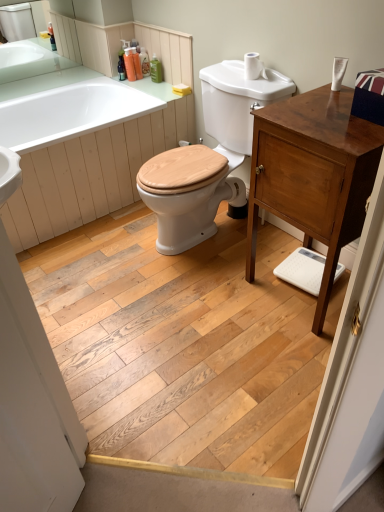
Question: Does white glossy bathtub at upper left come behind shiny brown cabinet at right?

Choices:
 (A) yes
 (B) no

Answer: (A)

Question: Is white glossy bathtub at upper left positioned with its back to shiny brown cabinet at right?

Choices:
 (A) no
 (B) yes

Answer: (A)

Question: From the image's perspective, is white glossy bathtub at upper left below shiny brown cabinet at right?

Choices:
 (A) no
 (B) yes

Answer: (A)

Question: Can you confirm if white glossy bathtub at upper left is shorter than shiny brown cabinet at right?

Choices:
 (A) yes
 (B) no

Answer: (A)

Question: Can you confirm if white glossy bathtub at upper left is positioned to the right of shiny brown cabinet at right?

Choices:
 (A) yes
 (B) no

Answer: (B)

Question: Is translucent plastic soap dispenser at upper center, which is counted as the 3th toiletry, starting from the right, wider or thinner than green matte countertop at upper left?

Choices:
 (A) thin
 (B) wide

Answer: (A)

Question: In terms of height, does translucent plastic soap dispenser at upper center, the second toiletry positioned from the left, look taller or shorter compared to green matte countertop at upper left?

Choices:
 (A) short
 (B) tall

Answer: (B)

Question: From a real-world perspective, relative to green matte countertop at upper left, is translucent plastic soap dispenser at upper center, the second toiletry positioned from the left, vertically above or below?

Choices:
 (A) above
 (B) below

Answer: (A)

Question: Is translucent plastic soap dispenser at upper center, which is counted as the 3th toiletry, starting from the right, inside or outside of green matte countertop at upper left?

Choices:
 (A) outside
 (B) inside

Answer: (A)

Question: Choose the correct answer: Is natural wood floor at center inside shiny brown cabinet at right or outside it?

Choices:
 (A) outside
 (B) inside

Answer: (A)

Question: Is natural wood floor at center in front of or behind shiny brown cabinet at right in the image?

Choices:
 (A) behind
 (B) front

Answer: (B)

Question: Considering the positions of natural wood floor at center and shiny brown cabinet at right in the image, is natural wood floor at center taller or shorter than shiny brown cabinet at right?

Choices:
 (A) short
 (B) tall

Answer: (A)

Question: In terms of size, does natural wood floor at center appear bigger or smaller than shiny brown cabinet at right?

Choices:
 (A) big
 (B) small

Answer: (B)

Question: From their relative heights in the image, would you say white glossy bathtub at upper left is taller or shorter than green matte bottle at upper center, placed as the first toiletry when sorted from right to left?

Choices:
 (A) tall
 (B) short

Answer: (A)

Question: Is point (182, 112) positioned closer to the camera than point (155, 70)?

Choices:
 (A) farther
 (B) closer

Answer: (B)